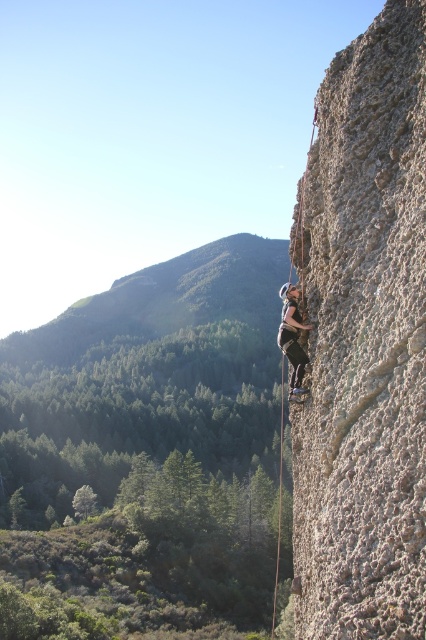
Is gray rough rock at right thinner than matte gray helmet at center?

In fact, gray rough rock at right might be wider than matte gray helmet at center.

Is gray rough rock at right positioned at the back of matte gray helmet at center?

No, gray rough rock at right is in front of matte gray helmet at center.

The image size is (426, 640). What are the coordinates of `gray rough rock at right` in the screenshot? It's located at 363,340.

Locate an element on the screen. This screenshot has width=426, height=640. gray rough rock at right is located at coordinates pyautogui.click(x=363, y=340).